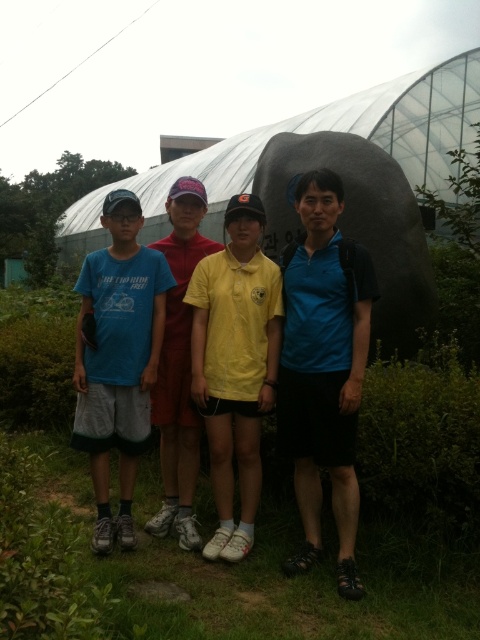
Is blue fabric shirt at right shorter than blue cotton t-shirt at left?

No.

From the picture: Can you confirm if blue fabric shirt at right is positioned below blue cotton t-shirt at left?

Yes.

I want to click on blue fabric shirt at right, so click(x=324, y=368).

Is point (308, 342) positioned before point (207, 436)?

Yes.

The image size is (480, 640). Describe the element at coordinates (324, 368) in the screenshot. I see `blue fabric shirt at right` at that location.

This screenshot has width=480, height=640. I want to click on blue fabric shirt at right, so click(x=324, y=368).

Is yellow matte shirt at center thinner than blue cotton t-shirt at left?

Indeed, yellow matte shirt at center has a lesser width compared to blue cotton t-shirt at left.

Is point (271, 332) positioned before point (128, 472)?

Yes, it is in front of point (128, 472).

This screenshot has height=640, width=480. Describe the element at coordinates (235, 364) in the screenshot. I see `yellow matte shirt at center` at that location.

At what (x,y) coordinates should I click in order to perform the action: click on yellow matte shirt at center. Please return your answer as a coordinate pair (x, y). The image size is (480, 640). Looking at the image, I should click on (235, 364).